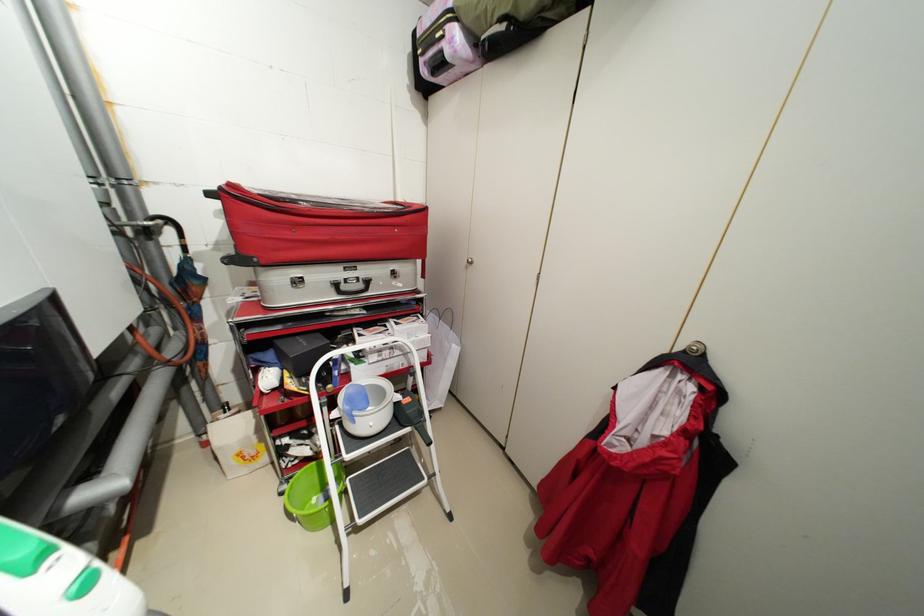
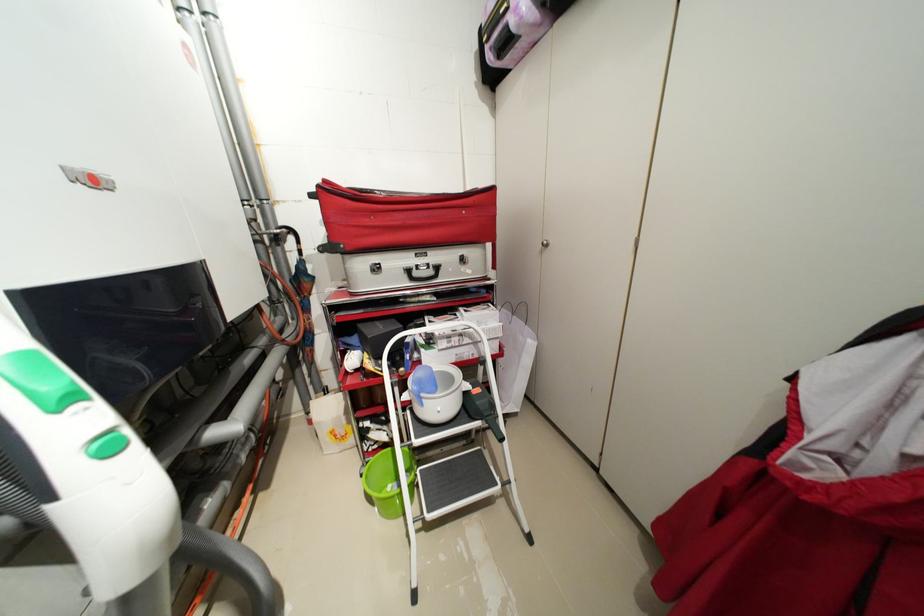
Find the pixel in the second image that matches point 359,419 in the first image.

(428, 400)